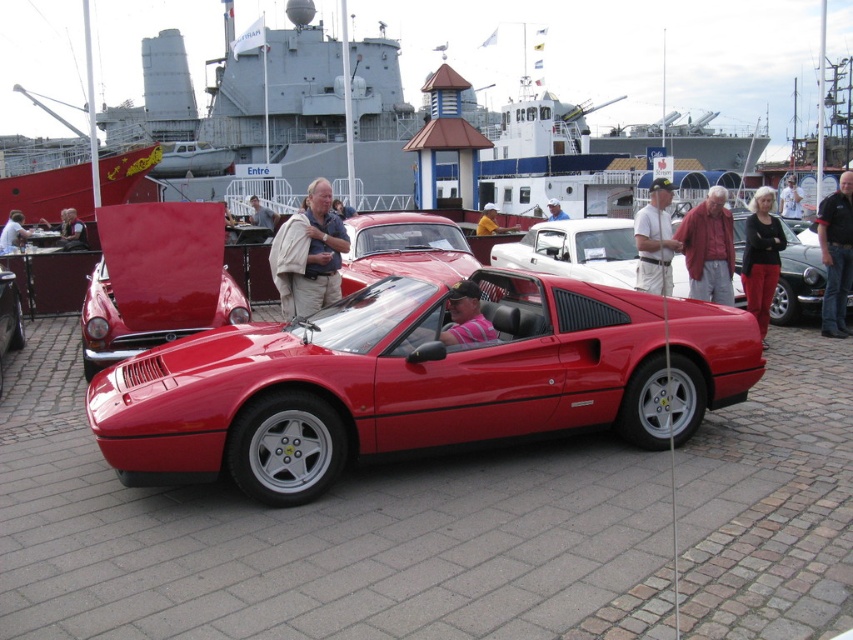
Question: Considering the real-world distances, which object is closest to the matte black car at center?

Choices:
 (A) shiny red convertible at center
 (B) shiny red ferrari at center

Answer: (A)

Question: Which object appears farthest from the camera in this image?

Choices:
 (A) matte black jacket at upper left
 (B) shiny red convertible at center
 (C) matte black jacket at upper right

Answer: (A)

Question: Is the position of shiny red convertible at center more distant than that of white fabric shirt at center?

Choices:
 (A) yes
 (B) no

Answer: (A)

Question: Which is nearer to the beige fabric jacket at center?

Choices:
 (A) matte black jacket at upper right
 (B) shiny red convertible at center
 (C) matte black car at center

Answer: (B)

Question: Does shiny red ferrari at center have a greater width compared to matte black jacket at upper left?

Choices:
 (A) yes
 (B) no

Answer: (A)

Question: Is white fabric shirt at center to the right of matte black car at center from the viewer's perspective?

Choices:
 (A) yes
 (B) no

Answer: (A)